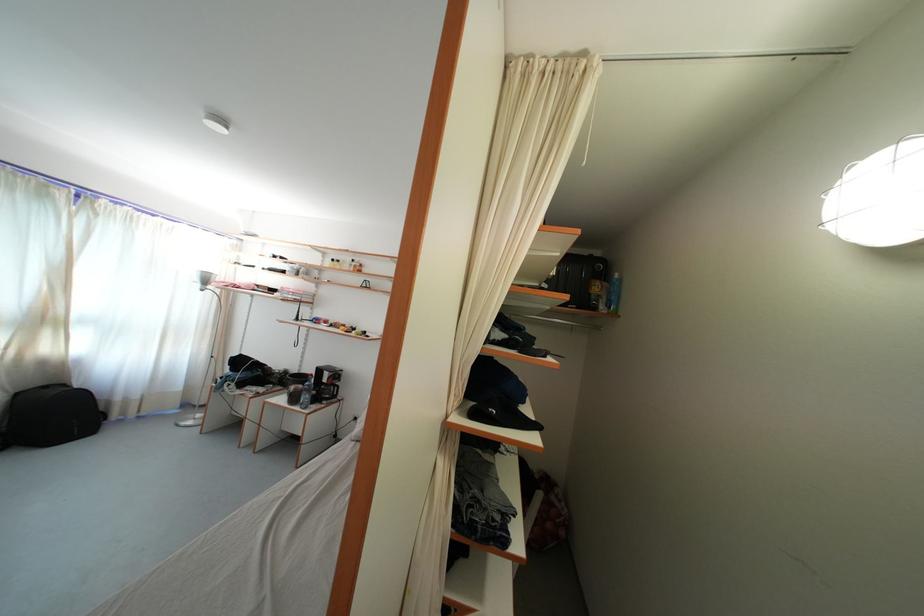
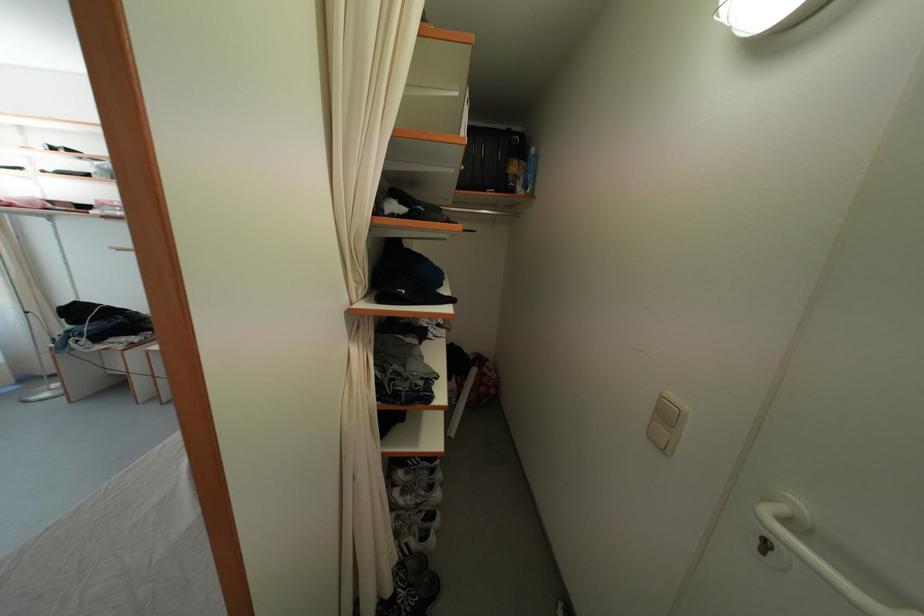
Locate, in the second image, the point that corresponds to (608,313) in the first image.

(525, 195)